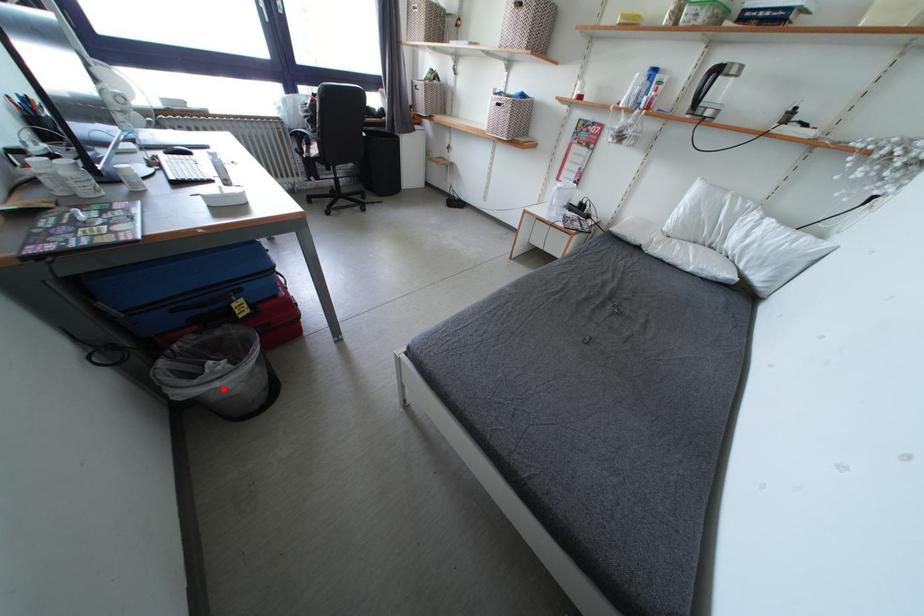
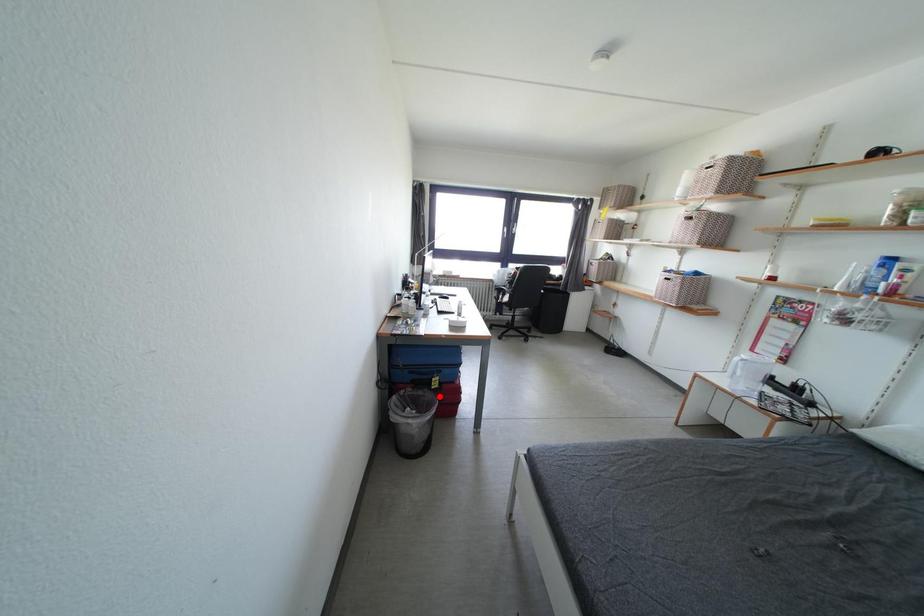
I am providing you with two images of the same scene from different viewpoints. A red point is marked on the first image and another point is marked on the second image. Is the red point in image1 aligned with the point shown in image2?

No